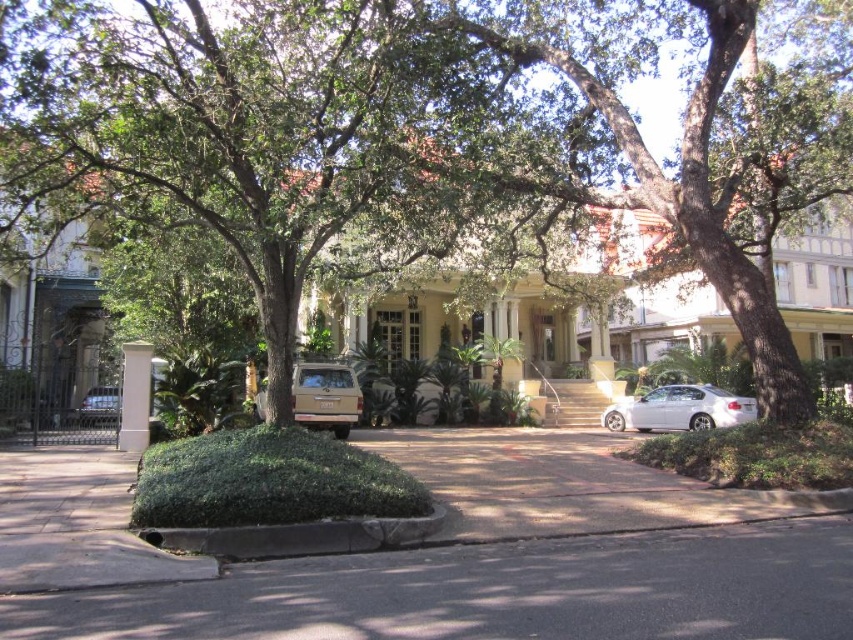
You are a delivery person arriving at the house and need to park your van. You see the dark gray asphalt at center and the white glossy sedan at center. Which parking spot is available for your van if the sedan is already occupying its space?

The dark gray asphalt at center is positioned on the left side of white glossy sedan at center, so the available parking spot for your van would be the dark gray asphalt at center since the white glossy sedan at center is already parked to its right.

You are a delivery driver with a truck that is 15 meters long. You need to park your truck between the two cars on the driveway. Is there enough space between the gold matte suv at center and the other car to park your truck?

The two cars are 15.28 meters apart, so yes, the truck can park between the gold matte suv at center and the other car since the space is slightly longer than the truck.

You are a delivery driver approaching the house and need to park your vehicle between the gold matte suv at center and the white painted wood column at center. Is there enough space for your vehicle, which is 2 meters wide, between them?

The gold matte suv at center is to the right of the white painted wood column at center, so there is space between them. Since your vehicle is 2 meters wide, you should check the exact distance between the gold matte suv at center and the white painted wood column at center to ensure it accommodates your vehicle. The scene description mentions two cars parked on the driveway, but the exact spacing isn